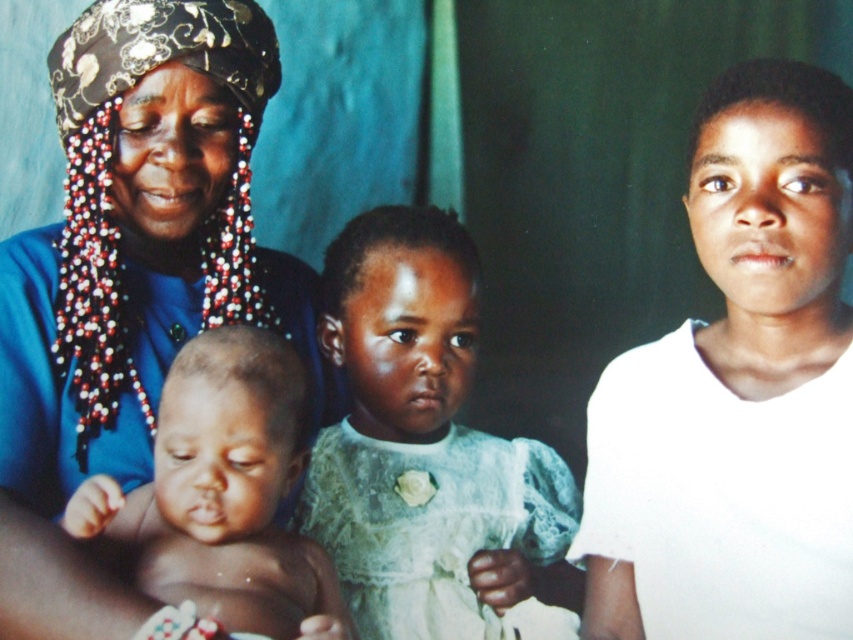
What do you see at coordinates (126, 280) in the screenshot?
I see `matte blue dress at center` at bounding box center [126, 280].

Is matte blue dress at center in front of smooth skin baby at center left?

No.

Is point (49, 548) positioned in front of point (77, 488)?

Yes, point (49, 548) is closer to viewer.

In order to click on matte blue dress at center in this screenshot , I will do `click(126, 280)`.

Who is positioned more to the left, light blue lace dress at center or smooth skin baby at center left?

smooth skin baby at center left is more to the left.

Can you confirm if light blue lace dress at center is smaller than smooth skin baby at center left?

Incorrect, light blue lace dress at center is not smaller in size than smooth skin baby at center left.

From the picture: Who is more distant from viewer, [341,451] or [161,404]?

Positioned behind is point [341,451].

Identify the location of light blue lace dress at center. (426, 448).

Is point (74, 208) more distant than point (352, 541)?

That is False.

Is point (158, 365) farther from camera compared to point (520, 561)?

No, it is not.

Where is `matte blue dress at center`? The height and width of the screenshot is (640, 853). matte blue dress at center is located at coordinates (126, 280).